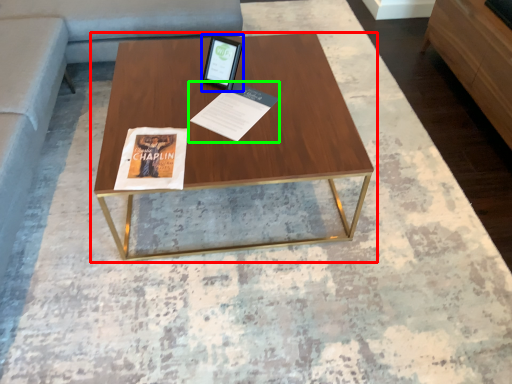
Question: Estimate the real-world distances between objects in this image. Which object is closer to coffee table (highlighted by a red box), tablet computer (highlighted by a blue box) or magazine (highlighted by a green box)?

Choices:
 (A) tablet computer
 (B) magazine

Answer: (B)